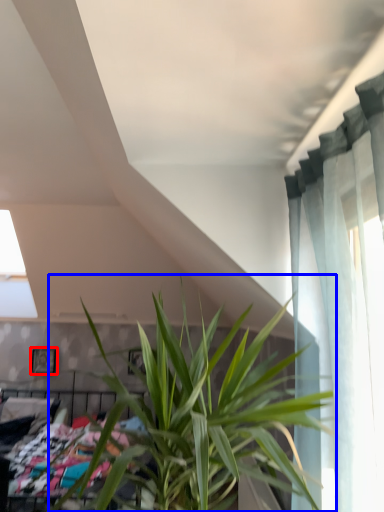
Question: Which object is closer to the camera taking this photo, picture frame (highlighted by a red box) or houseplant (highlighted by a blue box)?

Choices:
 (A) picture frame
 (B) houseplant

Answer: (B)